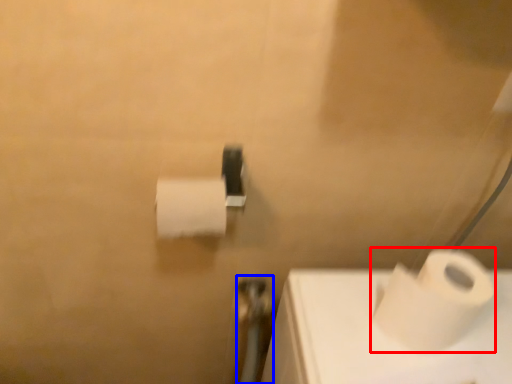
Question: Which object appears closest to the camera in this image, toilet paper (highlighted by a red box) or shower (highlighted by a blue box)?

Choices:
 (A) toilet paper
 (B) shower

Answer: (A)